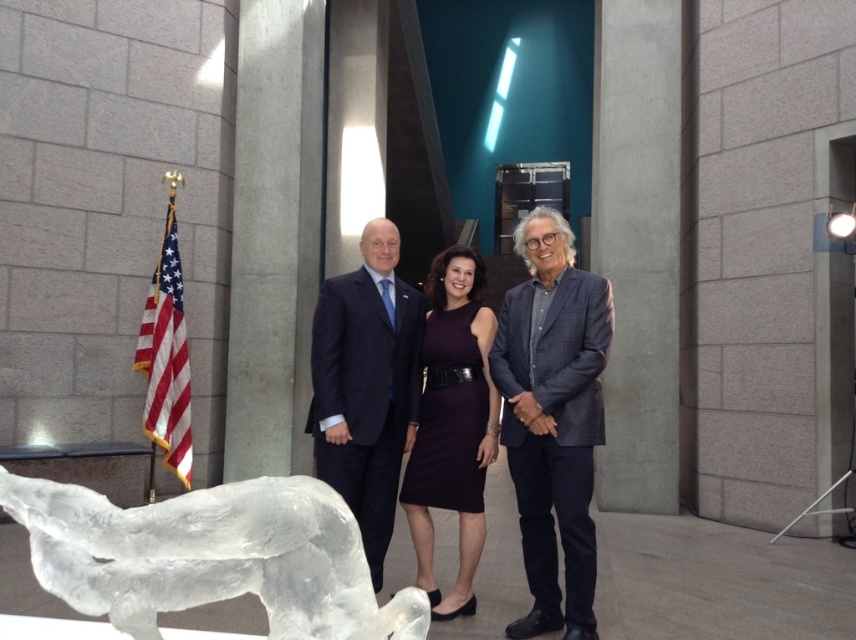
Question: Which point is closer to the camera taking this photo?

Choices:
 (A) (x=538, y=404)
 (B) (x=322, y=408)

Answer: (A)

Question: Which point is closer to the camera?

Choices:
 (A) red fabric flag at left
 (B) dark purple dress at center
 (C) dark blue pinstripe suit at center

Answer: (B)

Question: Among these objects, which one is nearest to the camera?

Choices:
 (A) purple satin dress at center
 (B) clear ice sculpture at lower left

Answer: (B)

Question: Does dark blue pinstripe suit at center have a larger size compared to red fabric flag at left?

Choices:
 (A) no
 (B) yes

Answer: (B)

Question: Can you confirm if blue plaid blazer at center is bigger than dark blue pinstripe suit at center?

Choices:
 (A) no
 (B) yes

Answer: (B)

Question: Is clear ice sculpture at lower left below blue plaid blazer at center?

Choices:
 (A) no
 (B) yes

Answer: (A)